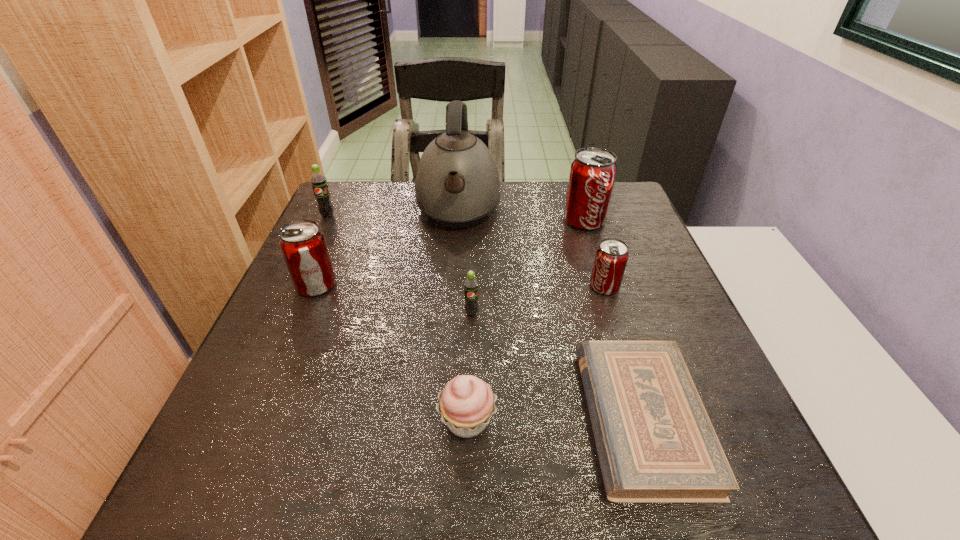
The height and width of the screenshot is (540, 960). In order to click on gray kettle in this screenshot , I will do `click(457, 184)`.

I want to click on the tallest object, so click(457, 184).

You are a GUI agent. You are given a task and a screenshot of the screen. Output one action in this format:
    pyautogui.click(x=<x>, y=<y>)
    Task: Click on the biggest red pop soda
    
    Given the screenshot: What is the action you would take?
    pyautogui.click(x=592, y=175)

I want to click on the farthest red pop soda, so click(x=592, y=175).

I want to click on the farther green soda, so click(x=319, y=182).

Where is `the bigger green soda`? This screenshot has width=960, height=540. the bigger green soda is located at coordinates (319, 182).

Where is `the leftmost red pop soda`? the leftmost red pop soda is located at coordinates (303, 245).

The image size is (960, 540). I want to click on the smallest red pop soda, so click(x=611, y=257).

This screenshot has height=540, width=960. In order to click on the right green soda in this screenshot , I will do `click(471, 307)`.

This screenshot has height=540, width=960. Identify the location of the third soda from right to left. (471, 307).